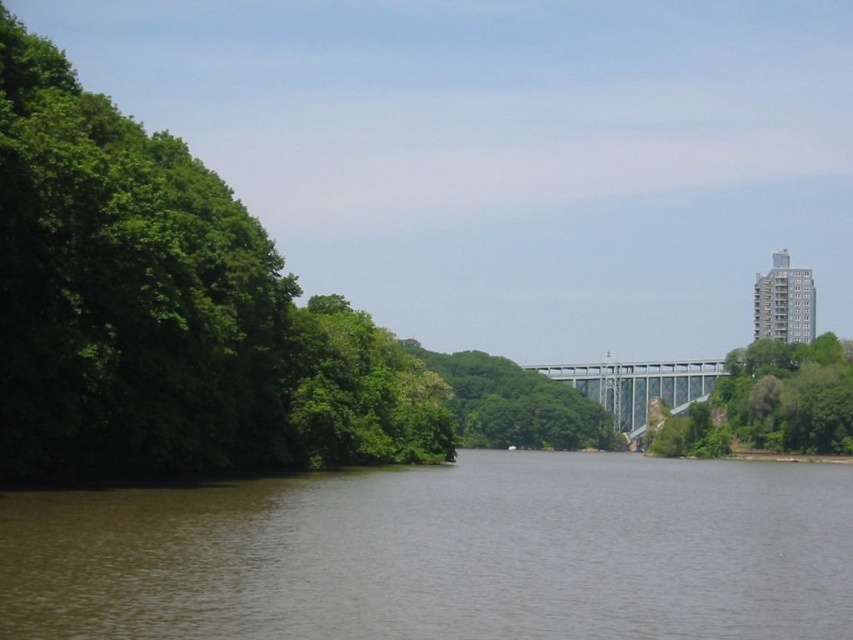
Identify the location of brown water at center. (444, 554).

Looking at this image, is the position of brown water at center less distant than that of green leafy tree at right?

Yes, it is.

You are a GUI agent. You are given a task and a screenshot of the screen. Output one action in this format:
    pyautogui.click(x=<x>, y=<y>)
    Task: Click on the brown water at center
    Image resolution: width=853 pixels, height=640 pixels.
    Given the screenshot: What is the action you would take?
    pyautogui.click(x=444, y=554)

What do you see at coordinates (444, 554) in the screenshot? I see `brown water at center` at bounding box center [444, 554].

Who is shorter, brown water at center or green leafy trees at left?

With less height is brown water at center.

Is point (405, 490) positioned behind point (247, 305)?

No.

I want to click on brown water at center, so click(444, 554).

Does green leafy trees at left appear on the right side of green leafy tree at right?

Incorrect, green leafy trees at left is not on the right side of green leafy tree at right.

Is point (57, 244) in front of point (814, 397)?

Yes, it is.

Where is `green leafy trees at left`? green leafy trees at left is located at coordinates (167, 310).